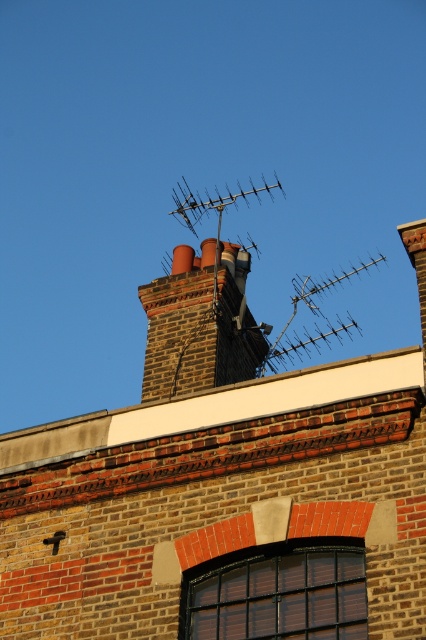
From the picture: You are standing in front of a brick building and see two points marked on the facade. The first point is at coordinates point (172, 355) and the second is at point (307, 356). Which point is closer to you?

Point (172, 355) is in front of point (307, 356), so it is closer to you.

You are installing a new satellite dish and need to choose between placing it on the metallic antenna at upper center or the metallic silver antenna at center. Which antenna can support the dish better based on size?

The metallic antenna at upper center has a larger size compared to the metallic silver antenna at center, so it can support the dish better due to its larger size.

You are standing in front of a brick building and see a point marked at coordinates (199, 323). Based on the scene description, what does this point most likely indicate?

The point at (199, 323) marks the brick chimney at center.